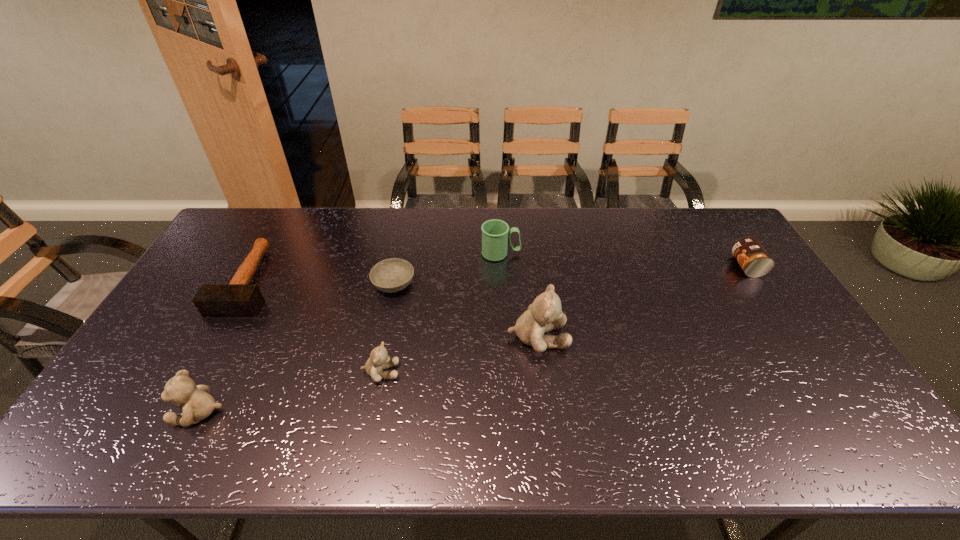
You are a GUI agent. You are given a task and a screenshot of the screen. Output one action in this format:
    pyautogui.click(x=<x>, y=<y>)
    Task: Click on the nearest teddy bear
    
    Given the screenshot: What is the action you would take?
    pyautogui.click(x=197, y=404)

Identify the location of the nearest object. The width and height of the screenshot is (960, 540). (197, 404).

The width and height of the screenshot is (960, 540). I want to click on the second teddy bear from left to right, so click(x=379, y=359).

You are a GUI agent. You are given a task and a screenshot of the screen. Output one action in this format:
    pyautogui.click(x=<x>, y=<y>)
    Task: Click on the second nearest object
    Image resolution: width=960 pixels, height=540 pixels.
    Given the screenshot: What is the action you would take?
    pyautogui.click(x=379, y=359)

Where is `the rightmost teddy bear`? The width and height of the screenshot is (960, 540). the rightmost teddy bear is located at coordinates (544, 314).

What are the coordinates of `the tallest teddy bear` in the screenshot? It's located at (544, 314).

This screenshot has width=960, height=540. What are the coordinates of `the sixth tallest object` in the screenshot? It's located at (238, 298).

Identify the location of mug. This screenshot has height=540, width=960. [x=495, y=233].

This screenshot has height=540, width=960. What are the coordinates of `the shortest object` in the screenshot? It's located at (392, 275).

The width and height of the screenshot is (960, 540). Find the location of `can`. can is located at coordinates (753, 259).